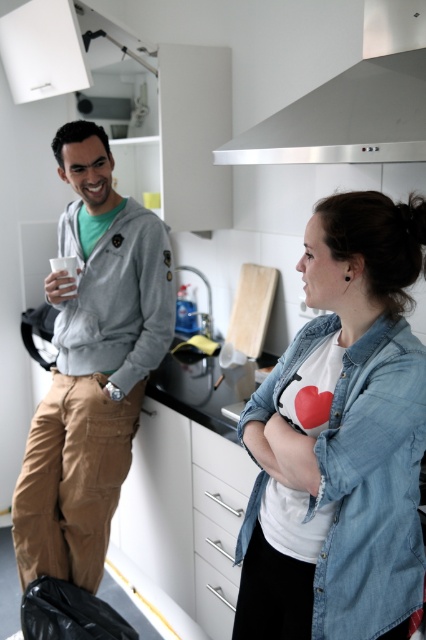
Question: Can you confirm if stainless steel exhaust hood at upper center is smaller than black matte counter top at center?

Choices:
 (A) yes
 (B) no

Answer: (B)

Question: Which point appears closest to the camera in this image?

Choices:
 (A) (256, 532)
 (B) (402, 124)
 (C) (118, 307)

Answer: (A)

Question: Considering the real-world distances, which object is farthest from the matte gray hoodie at left?

Choices:
 (A) stainless steel exhaust hood at upper center
 (B) denim shirt at center

Answer: (B)

Question: Is denim shirt at center behind black matte counter top at center?

Choices:
 (A) no
 (B) yes

Answer: (A)

Question: Which object is positioned farthest from the black matte counter top at center?

Choices:
 (A) matte gray hoodie at left
 (B) denim shirt at center

Answer: (B)

Question: Is denim shirt at center behind black matte counter top at center?

Choices:
 (A) yes
 (B) no

Answer: (B)